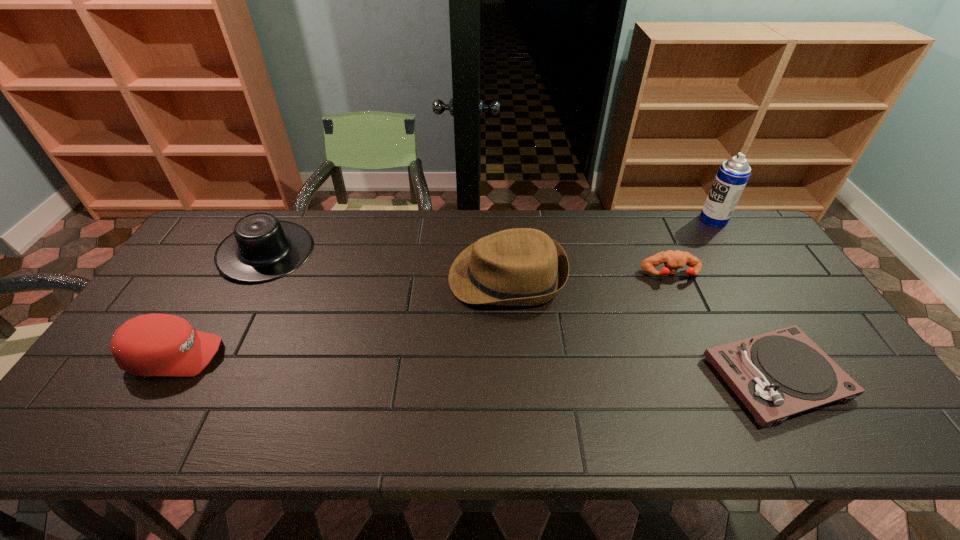
Find the location of `dress hat located at the left edge`. dress hat located at the left edge is located at coordinates pyautogui.click(x=262, y=248).

Find the location of a particular element. The width and height of the screenshot is (960, 540). cap at the left edge is located at coordinates (154, 344).

You are a GUI agent. You are given a task and a screenshot of the screen. Output one action in this format:
    pyautogui.click(x=<x>, y=<y>)
    Task: Click on the aerosol can present at the right edge
    
    Given the screenshot: What is the action you would take?
    pyautogui.click(x=733, y=174)

What are the coordinates of `phonograph_record that is at the right edge` in the screenshot? It's located at (777, 374).

This screenshot has width=960, height=540. I want to click on object located at the far left corner, so click(x=262, y=248).

The image size is (960, 540). I want to click on object present at the far right corner, so click(x=733, y=174).

Where is `object that is at the near right corner`? Image resolution: width=960 pixels, height=540 pixels. object that is at the near right corner is located at coordinates (777, 374).

In the image, there is a desktop. Find the location of `vacant region at the far edge`. vacant region at the far edge is located at coordinates (640, 214).

The width and height of the screenshot is (960, 540). In the image, there is a desktop. Find the location of `free space at the near edge`. free space at the near edge is located at coordinates (228, 431).

At what (x,y) coordinates should I click in order to perform the action: click on vacant region at the left edge of the desktop. Please return your answer as a coordinate pair (x, y). Looking at the image, I should click on (182, 306).